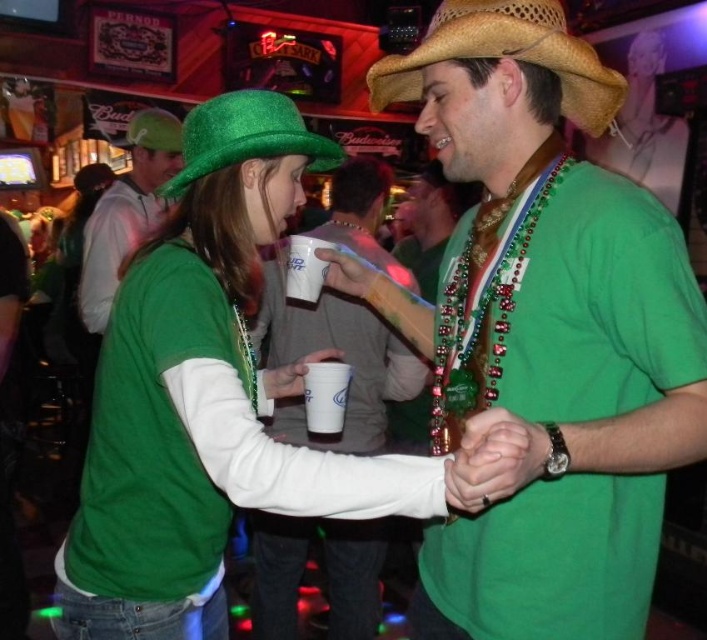
Question: Does green felt hat at upper left appear on the left side of green glittery hat at upper left?

Choices:
 (A) no
 (B) yes

Answer: (B)

Question: Which point is farther to the camera?

Choices:
 (A) green matte shirt at center
 (B) white paper cup at center
 (C) straw hat at upper center
 (D) matte green shirt at center

Answer: (D)

Question: Can you confirm if straw hat at upper center is positioned below green glittery hat at upper left?

Choices:
 (A) no
 (B) yes

Answer: (A)

Question: Which object appears closest to the camera in this image?

Choices:
 (A) straw hat at upper center
 (B) green matte shirt at center
 (C) shiny green hat at upper left
 (D) matte green shirt at center

Answer: (C)

Question: Which point is closer to the camera?

Choices:
 (A) (x=469, y=156)
 (B) (x=100, y=234)
 (C) (x=467, y=13)

Answer: (C)

Question: Does straw hat at upper center appear on the left side of white paper cup at center?

Choices:
 (A) no
 (B) yes

Answer: (A)